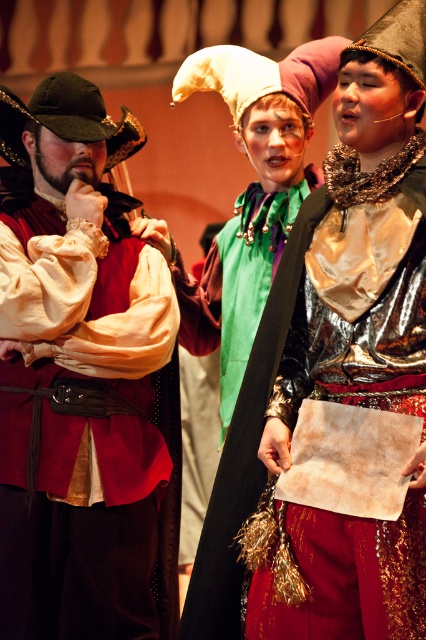
Question: Which point appears farthest from the camera in this image?

Choices:
 (A) (258, 561)
 (B) (118, 316)

Answer: (B)

Question: Which object appears farthest from the camera in this image?

Choices:
 (A) matte red vest at left
 (B) metallic gold dress at center

Answer: (A)

Question: Is matte red vest at left to the right of metallic gold dress at center from the viewer's perspective?

Choices:
 (A) yes
 (B) no

Answer: (B)

Question: Observing the image, what is the correct spatial positioning of matte red vest at left in reference to metallic gold dress at center?

Choices:
 (A) above
 (B) below

Answer: (B)

Question: Can you confirm if matte red vest at left is thinner than metallic gold dress at center?

Choices:
 (A) no
 (B) yes

Answer: (A)